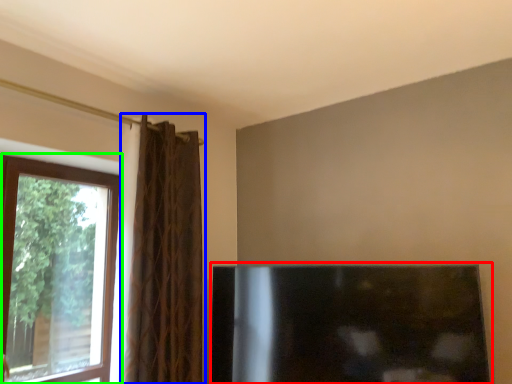
Question: Considering the real-world distances, which object is farthest from fireplace (highlighted by a red box)? curtain (highlighted by a blue box) or window (highlighted by a green box)?

Choices:
 (A) curtain
 (B) window

Answer: (B)